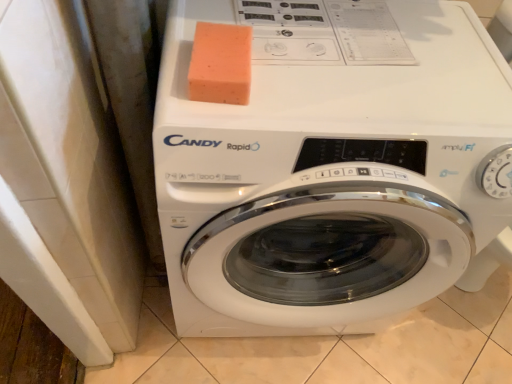
Question: Would you say orange sponge at upper center is to the left or to the right of white glossy washing machine at center in the picture?

Choices:
 (A) left
 (B) right

Answer: (A)

Question: Would you say orange sponge at upper center is inside or outside white glossy washing machine at center?

Choices:
 (A) outside
 (B) inside

Answer: (B)

Question: Based on their sizes in the image, would you say orange sponge at upper center is bigger or smaller than white glossy washing machine at center?

Choices:
 (A) big
 (B) small

Answer: (B)

Question: Is white glossy washing machine at center wider or thinner than orange sponge at upper center?

Choices:
 (A) wide
 (B) thin

Answer: (A)

Question: From the image's perspective, relative to orange sponge at upper center, is white glossy washing machine at center above or below?

Choices:
 (A) above
 (B) below

Answer: (B)

Question: Is white glossy washing machine at center to the left or to the right of orange sponge at upper center in the image?

Choices:
 (A) right
 (B) left

Answer: (A)

Question: From their relative heights in the image, would you say white glossy washing machine at center is taller or shorter than orange sponge at upper center?

Choices:
 (A) tall
 (B) short

Answer: (A)